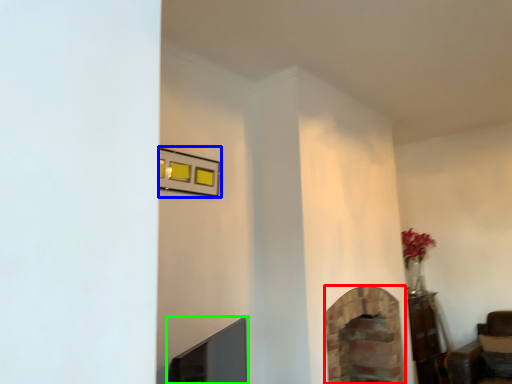
Question: Which object is positioned farthest from fireplace (highlighted by a red box)? Select from picture frame (highlighted by a blue box) and fireplace (highlighted by a green box).

Choices:
 (A) picture frame
 (B) fireplace

Answer: (A)